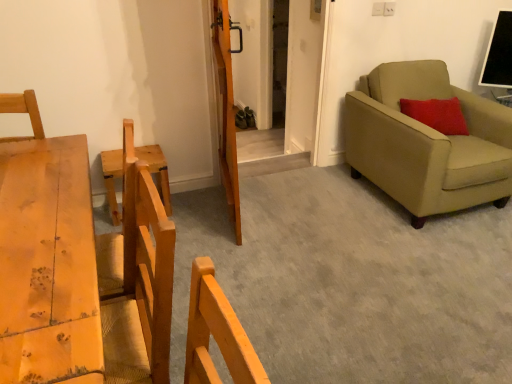
At what (x,y) coordinates should I click in order to perform the action: click on wooden door at center. Please return your answer as a coordinate pair (x, y). Looking at the image, I should click on (226, 109).

Identify the location of beige fabric armchair at right. The height and width of the screenshot is (384, 512). (426, 142).

The width and height of the screenshot is (512, 384). What do you see at coordinates (48, 264) in the screenshot?
I see `light brown wooden table at left` at bounding box center [48, 264].

I want to click on wooden chair at left, so click(123, 172).

Where is `door lying above the wooden chair at left (from the image's perspective)`? This screenshot has height=384, width=512. door lying above the wooden chair at left (from the image's perspective) is located at coordinates (226, 109).

How many degrees apart are the facing directions of wooden door at center and wooden chair at left?

The angular difference between wooden door at center and wooden chair at left is 75.8 degrees.

Is wooden door at center bigger than wooden chair at left?

Correct, wooden door at center is larger in size than wooden chair at left.

In terms of height, does wooden door at center look taller or shorter compared to wooden chair at left?

A: wooden door at center is taller than wooden chair at left.

Which is more to the right, wooden barn door at center or light brown wooden table at left?

wooden barn door at center is more to the right.

How different are the orientations of wooden barn door at center and light brown wooden table at left in degrees?

The angle between the facing direction of wooden barn door at center and the facing direction of light brown wooden table at left is 2.8 degrees.

Is wooden barn door at center located outside light brown wooden table at left?

wooden barn door at center is positioned outside light brown wooden table at left.

Based on the photo, is wooden barn door at center oriented towards light brown wooden table at left?

No, wooden barn door at center is not oriented towards light brown wooden table at left.

Who is more distant, light brown wooden table at left or wooden chair at left?

wooden chair at left is further from the camera.

Does light brown wooden table at left have a larger size compared to wooden chair at left?

Yes.

Can you tell me how much light brown wooden table at left and wooden chair at left differ in facing direction?

The facing directions of light brown wooden table at left and wooden chair at left are 94.6 degrees apart.

Which is correct: light brown wooden table at left is inside wooden chair at left, or outside of it?

light brown wooden table at left is outside wooden chair at left.

Which object is positioned more to the left, beige fabric armchair at right or wooden chair at left?

From the viewer's perspective, wooden chair at left appears more on the left side.

From the image's perspective, does beige fabric armchair at right appear lower than wooden chair at left?

Actually, beige fabric armchair at right appears above wooden chair at left in the image.

From a real-world perspective, is beige fabric armchair at right physically above wooden chair at left?

Yes.

This screenshot has height=384, width=512. In order to click on studio couch that appears in front of the wooden chair at left in this screenshot , I will do `click(426, 142)`.

Considering their positions, is beige fabric armchair at right located in front of or behind wooden barn door at center?

beige fabric armchair at right is positioned closer to the viewer than wooden barn door at center.

Is beige fabric armchair at right surrounding wooden barn door at center?

No.

In terms of height, does light brown wooden table at left look taller or shorter compared to beige fabric armchair at right?

Clearly, light brown wooden table at left is taller compared to beige fabric armchair at right.

Is light brown wooden table at left wider or thinner than beige fabric armchair at right?

light brown wooden table at left is thinner than beige fabric armchair at right.

Considering the points (12, 270) and (398, 76), which point is behind, point (12, 270) or point (398, 76)?

The point (398, 76) is more distant.

Is the surface of light brown wooden table at left in direct contact with beige fabric armchair at right?

No, light brown wooden table at left is not beside beige fabric armchair at right.

Between wooden door at center and wooden barn door at center, which one has more height?

With more height is wooden barn door at center.

From the image's perspective, would you say wooden door at center is positioned over wooden barn door at center?

No, from the image's perspective, wooden door at center is not above wooden barn door at center.

Which of these two, wooden door at center or wooden barn door at center, is bigger?

Bigger between the two is wooden barn door at center.

Considering the sizes of wooden door at center and wooden barn door at center in the image, is wooden door at center wider or thinner than wooden barn door at center?

In the image, wooden door at center appears to be more narrow than wooden barn door at center.

Identify the location of door in front of the wooden chair at left. Image resolution: width=512 pixels, height=384 pixels. (226, 109).

Identify the location of furniture located above the wooden barn door at center (from a real-world perspective). (48, 264).

Based on their spatial positions, is wooden chair at left or wooden barn door at center closer to beige fabric armchair at right?

The object closer to beige fabric armchair at right is wooden barn door at center.

Looking at the image, which one is located further to wooden barn door at center, beige fabric armchair at right or wooden chair at left?

wooden chair at left lies further to wooden barn door at center than the other object.

Which object lies further to the anchor point beige fabric armchair at right, wooden door at center or wooden chair at left?

Among the two, wooden chair at left is located further to beige fabric armchair at right.

Estimate the real-world distances between objects in this image. Which object is further from wooden chair at left, wooden barn door at center or beige fabric armchair at right?

The object further to wooden chair at left is beige fabric armchair at right.

Which object lies nearer to the anchor point light brown wooden table at left, wooden door at center or beige fabric armchair at right?

wooden door at center.

Based on their spatial positions, is wooden door at center or wooden chair at left closer to light brown wooden table at left?

wooden chair at left is positioned closer to the anchor light brown wooden table at left.

Looking at the image, which one is located further to wooden chair at left, light brown wooden table at left or wooden barn door at center?

wooden barn door at center is further to wooden chair at left.

Estimate the real-world distances between objects in this image. Which object is further from wooden chair at left, wooden door at center or wooden barn door at center?

Among the two, wooden barn door at center is located further to wooden chair at left.

Identify the location of door between wooden chair at left and beige fabric armchair at right. This screenshot has height=384, width=512. (226, 109).

Where is `furniture between wooden chair at left and beige fabric armchair at right`? The width and height of the screenshot is (512, 384). furniture between wooden chair at left and beige fabric armchair at right is located at coordinates (48, 264).

Identify the location of door located between light brown wooden table at left and wooden chair at left in the depth direction. (226, 109).

I want to click on barn door between wooden chair at left and beige fabric armchair at right from left to right, so click(x=283, y=84).